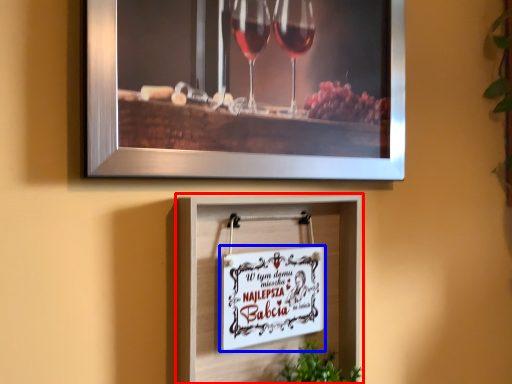
Question: Among these objects, which one is nearest to the camera, picture frame (highlighted by a red box) or picture frame (highlighted by a blue box)?

Choices:
 (A) picture frame
 (B) picture frame

Answer: (A)